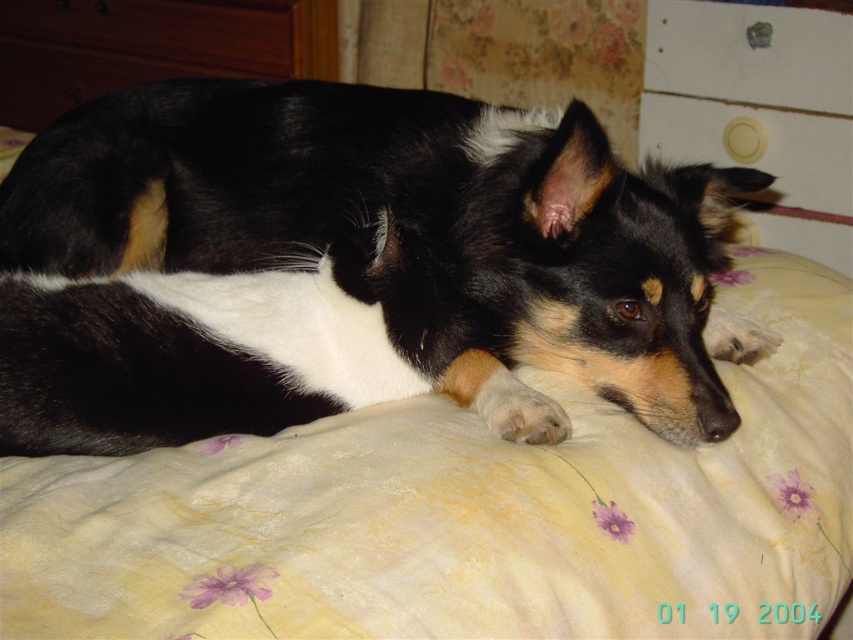
Question: Is yellow floral fabric at center to the right of black and white fur at center from the viewer's perspective?

Choices:
 (A) no
 (B) yes

Answer: (B)

Question: Which object appears closest to the camera in this image?

Choices:
 (A) yellow floral fabric at center
 (B) black and white fur at center

Answer: (A)

Question: Which point is closer to the camera?

Choices:
 (A) (445, 429)
 (B) (625, 378)

Answer: (A)

Question: Is yellow floral fabric at center to the right of black and white fur at center from the viewer's perspective?

Choices:
 (A) no
 (B) yes

Answer: (B)

Question: Can you confirm if yellow floral fabric at center is thinner than black and white fur at center?

Choices:
 (A) no
 (B) yes

Answer: (B)

Question: Among these points, which one is farthest from the camera?

Choices:
 (A) (645, 556)
 (B) (491, 314)

Answer: (B)